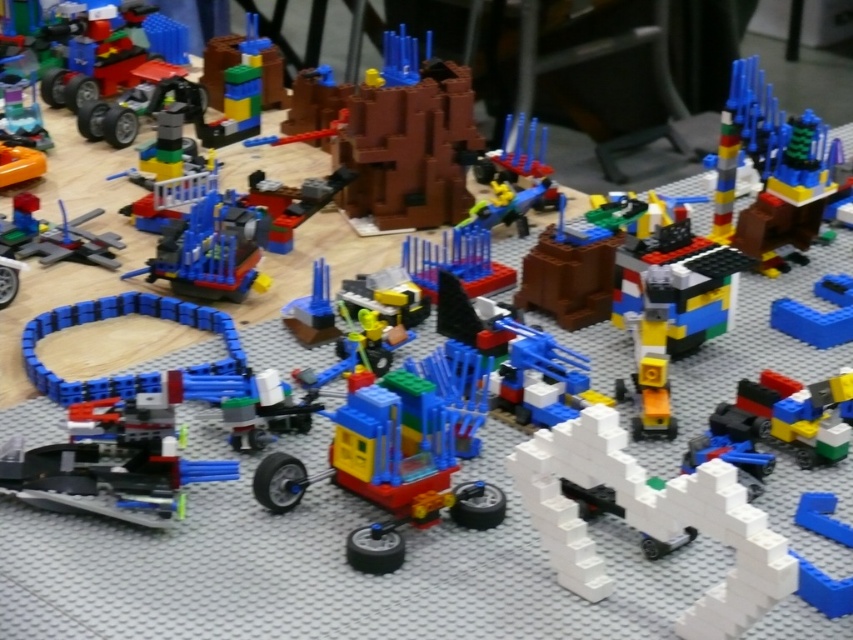
Question: Which of the following is the closest to the observer?

Choices:
 (A) (730, 484)
 (B) (201, 211)

Answer: (A)

Question: Which object is the farthest from the translucent yellow car at center?

Choices:
 (A) multicolored plastic robot at center
 (B) translucent blue plastic gear at center

Answer: (B)

Question: Considering the relative positions of multicolored plastic robot at center and translucent blue plastic gear at center in the image provided, where is multicolored plastic robot at center located with respect to translucent blue plastic gear at center?

Choices:
 (A) left
 (B) right

Answer: (B)

Question: Is translucent yellow car at center positioned in front of blue plastic track at center-left?

Choices:
 (A) yes
 (B) no

Answer: (A)

Question: Where is translucent blue plastic tower at upper right located in relation to blue matte block at center-right in the image?

Choices:
 (A) below
 (B) above

Answer: (B)

Question: Considering the real-world distances, which object is farthest from the white matte brick wall at lower right?

Choices:
 (A) translucent blue plastic tower at upper right
 (B) translucent blue plastic gear at center
 (C) translucent yellow car at center

Answer: (A)